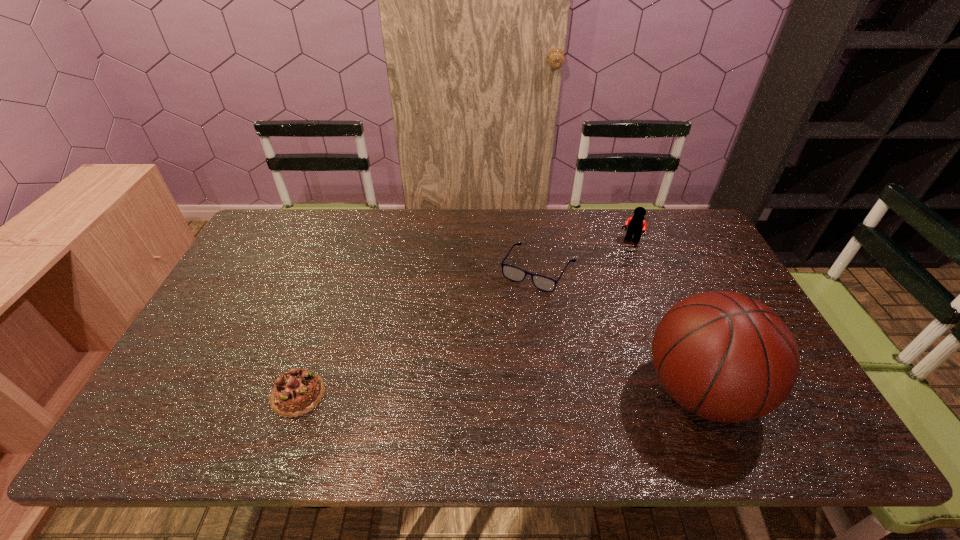
Where is `the leftmost object`? This screenshot has width=960, height=540. the leftmost object is located at coordinates (298, 391).

Locate an element on the screen. The width and height of the screenshot is (960, 540). basketball is located at coordinates (728, 358).

Find the location of a particular element. The image size is (960, 540). spectacles is located at coordinates (513, 273).

The height and width of the screenshot is (540, 960). I want to click on Lego, so click(636, 224).

Locate an element on the screen. Image resolution: width=960 pixels, height=540 pixels. vacant region located on the right of the chocolate cake is located at coordinates (371, 394).

This screenshot has width=960, height=540. In order to click on free space located on the back of the tallest object in this screenshot , I will do click(x=642, y=254).

The image size is (960, 540). What are the coordinates of `free spot located on the front-facing side of the spectacles` in the screenshot? It's located at (494, 343).

This screenshot has width=960, height=540. I want to click on vacant space located on the front-facing side of the spectacles, so click(x=487, y=356).

Image resolution: width=960 pixels, height=540 pixels. In order to click on free region located 0.210m on the front-facing side of the spectacles in this screenshot , I will do `click(494, 343)`.

This screenshot has width=960, height=540. I want to click on vacant space located 0.080m on the front-facing side of the third shortest object, so click(617, 260).